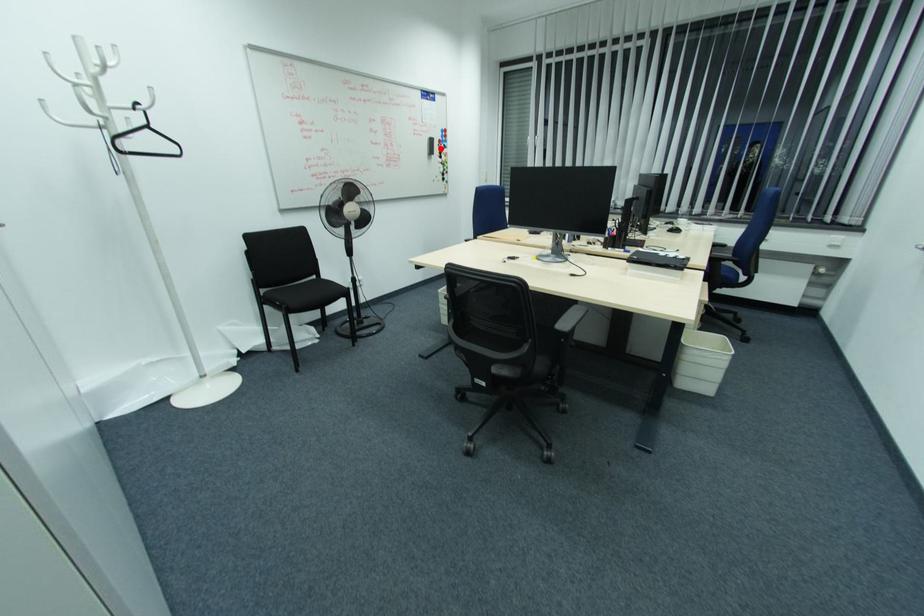
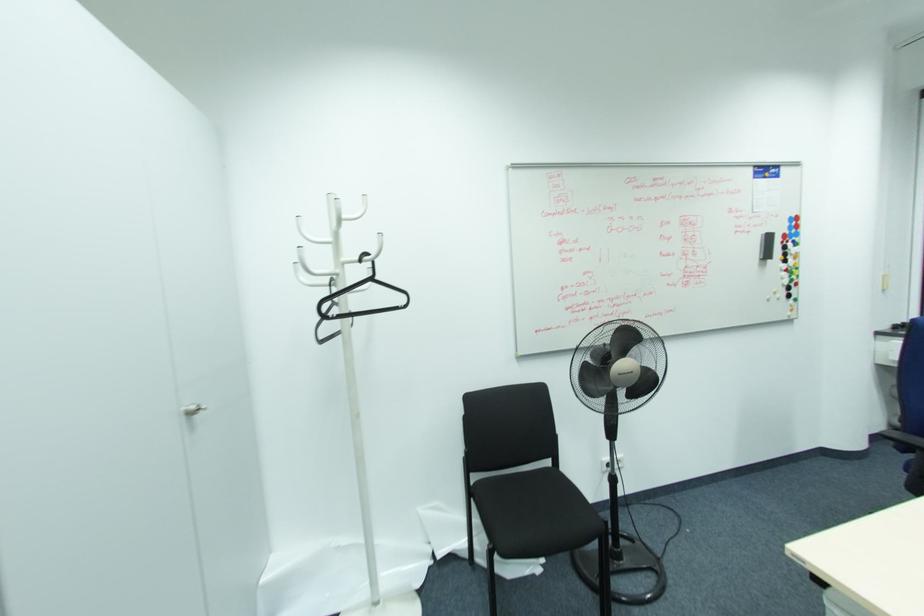
The point at the highlighted location is marked in the first image. Where is the corresponding point in the second image?

(785, 248)